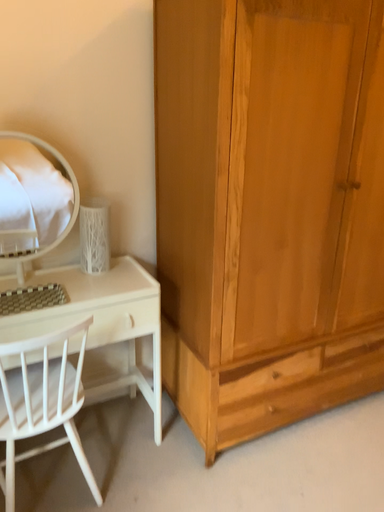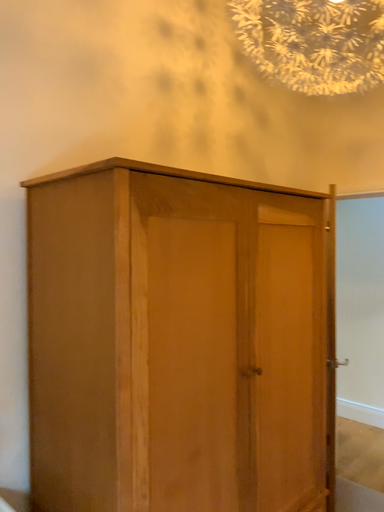
Question: How did the camera likely rotate when shooting the video?

Choices:
 (A) rotated upward
 (B) rotated downward

Answer: (A)